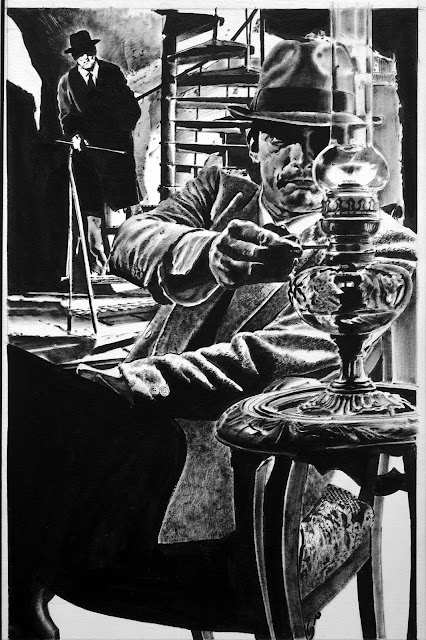
Where is `side table`? side table is located at coordinates 361,432.